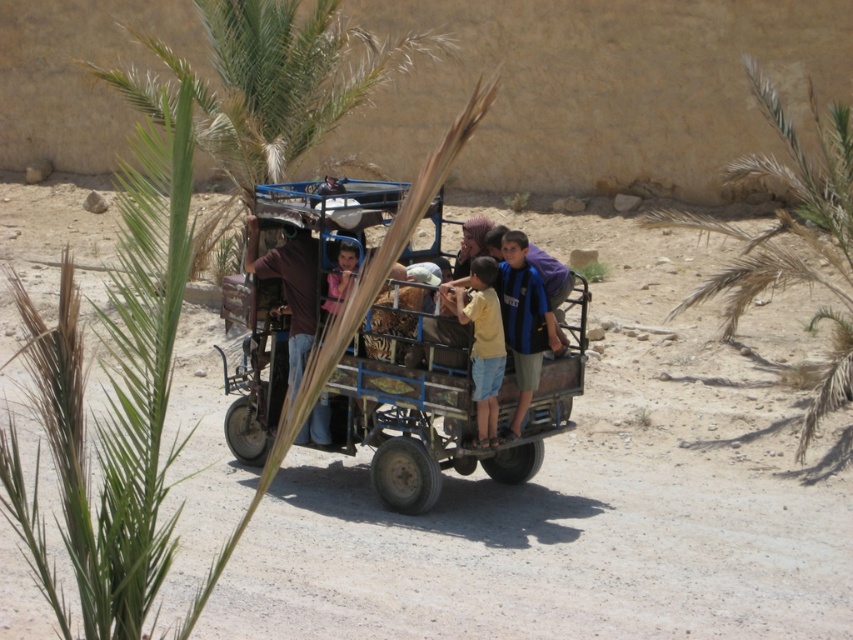
Can you confirm if brown leather jacket at center is positioned to the right of blue striped shirt at center?

In fact, brown leather jacket at center is to the left of blue striped shirt at center.

Who is positioned more to the right, brown leather jacket at center or blue striped shirt at center?

Positioned to the right is blue striped shirt at center.

Is point (299, 289) positioned before point (529, 285)?

No, (299, 289) is behind (529, 285).

At what (x,y) coordinates should I click in order to perform the action: click on brown leather jacket at center. Please return your answer as a coordinate pair (x, y). The height and width of the screenshot is (640, 853). Looking at the image, I should click on (289, 288).

Which is in front, point (386, 426) or point (473, 339)?

Point (473, 339) is more forward.

Is blue metallic wagon at center to the right of yellow matte shirt at center from the viewer's perspective?

No, blue metallic wagon at center is not to the right of yellow matte shirt at center.

Describe the element at coordinates (434, 400) in the screenshot. I see `blue metallic wagon at center` at that location.

At what (x,y) coordinates should I click in order to perform the action: click on blue metallic wagon at center. Please return your answer as a coordinate pair (x, y). This screenshot has height=640, width=853. Looking at the image, I should click on (434, 400).

In the scene shown: Can you confirm if blue striped shirt at center is shorter than yellow matte shirt at center?

No, blue striped shirt at center is not shorter than yellow matte shirt at center.

Does blue striped shirt at center appear on the right side of yellow matte shirt at center?

Correct, you'll find blue striped shirt at center to the right of yellow matte shirt at center.

Is point (524, 264) positioned behind point (494, 394)?

Yes.

I want to click on blue striped shirt at center, so click(523, 321).